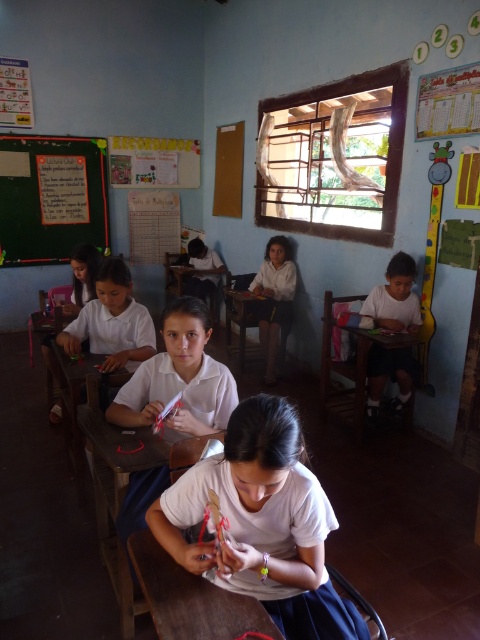
Question: Estimate the real-world distances between objects in this image. Which object is farther from the wooden table at right?

Choices:
 (A) wooden table at center
 (B) brown wooden table at lower center

Answer: (B)

Question: Is brown wooden table at lower center positioned in front of wooden table at right?

Choices:
 (A) no
 (B) yes

Answer: (B)

Question: Does brown wooden table at lower center appear over wooden table at center?

Choices:
 (A) yes
 (B) no

Answer: (B)

Question: Does brown wooden table at lower center have a greater width compared to wooden table at right?

Choices:
 (A) no
 (B) yes

Answer: (A)

Question: Estimate the real-world distances between objects in this image. Which object is farther from the green chalkboard at upper left?

Choices:
 (A) brown wooden table at lower center
 (B) wooden table at center
 (C) white matte shirt at right

Answer: (A)

Question: Which object is positioned farthest from the wooden table at center?

Choices:
 (A) white matte shirt at right
 (B) brown wooden table at lower center

Answer: (B)